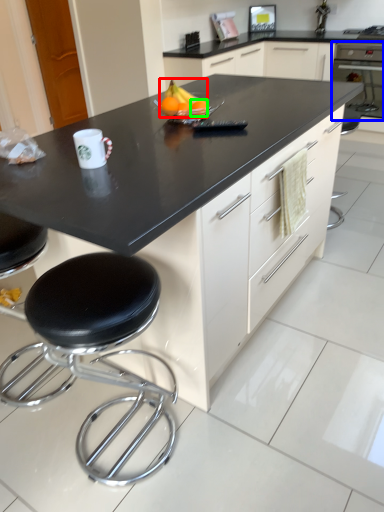
Question: Which object is positioned farthest from fruit (highlighted by a red box)? Select from oven (highlighted by a blue box) and orange (highlighted by a green box).

Choices:
 (A) oven
 (B) orange

Answer: (A)